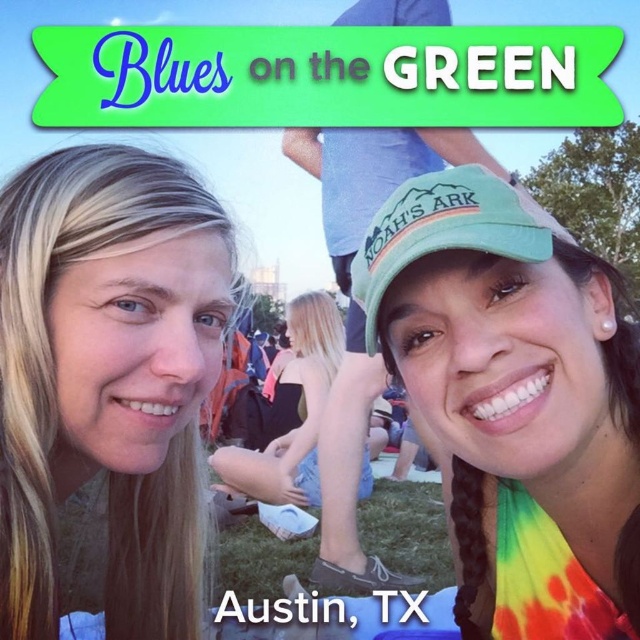
Question: Is green fabric cap at right to the right of green fabric baseball cap at center from the viewer's perspective?

Choices:
 (A) yes
 (B) no

Answer: (A)

Question: Which point is closer to the camera taking this photo?

Choices:
 (A) (506, 186)
 (B) (442, 339)

Answer: (A)

Question: Is blonde hair at left wider than green fabric baseball cap at center?

Choices:
 (A) yes
 (B) no

Answer: (A)

Question: Does blonde hair at left have a larger size compared to green fabric baseball cap at center?

Choices:
 (A) yes
 (B) no

Answer: (A)

Question: Based on their relative distances, which object is nearer to the green fabric baseball cap at center?

Choices:
 (A) green fabric cap at right
 (B) blonde hair at left

Answer: (A)

Question: Among these points, which one is nearest to the camera?

Choices:
 (A) (480, 412)
 (B) (106, 369)
 (C) (396, 262)

Answer: (C)